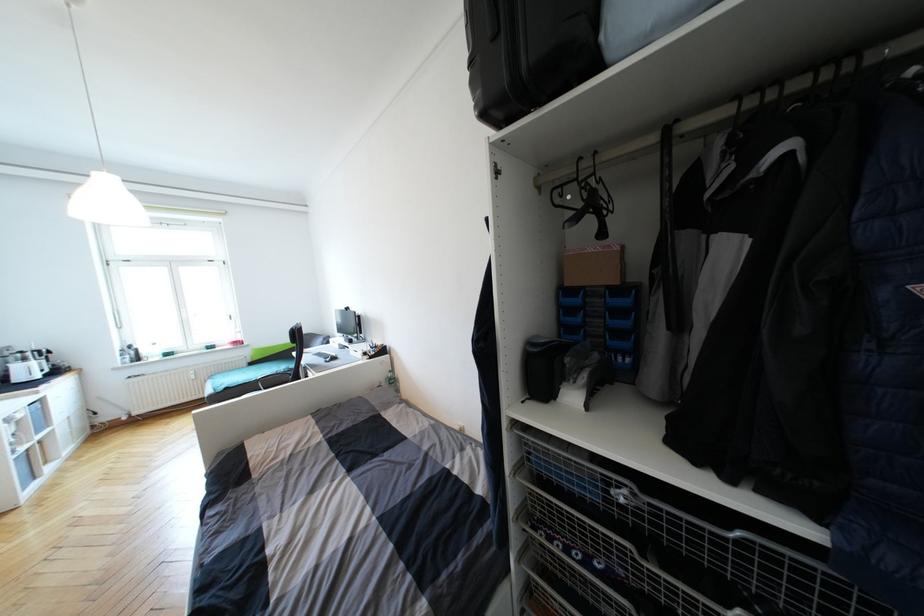
Where would you sit the chair sitting surface? Please return your answer as a coordinate pair (x, y).

(274, 379)